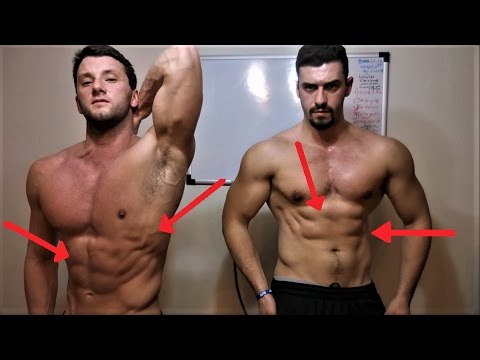
You are a GUI agent. You are given a task and a screenshot of the screen. Output one action in this format:
    pyautogui.click(x=<x>, y=<y>)
    Task: Click on the white dry erase board
    
    Given the screenshot: What is the action you would take?
    pyautogui.click(x=254, y=97)